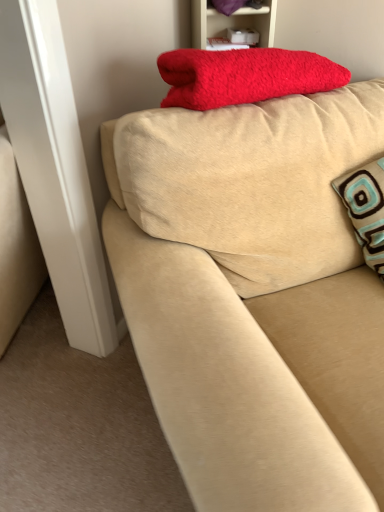
Question: Can you confirm if red fluffy blanket at upper center is shorter than beige fabric couch at upper center?

Choices:
 (A) yes
 (B) no

Answer: (A)

Question: Does red fluffy blanket at upper center appear on the right side of beige fabric couch at upper center?

Choices:
 (A) yes
 (B) no

Answer: (B)

Question: Is red fluffy blanket at upper center smaller than beige fabric couch at upper center?

Choices:
 (A) no
 (B) yes

Answer: (B)

Question: Considering the relative sizes of red fluffy blanket at upper center and beige fabric couch at upper center in the image provided, is red fluffy blanket at upper center taller than beige fabric couch at upper center?

Choices:
 (A) no
 (B) yes

Answer: (A)

Question: Is red fluffy blanket at upper center closer to the viewer compared to beige fabric couch at upper center?

Choices:
 (A) yes
 (B) no

Answer: (B)

Question: From the image's perspective, does red fluffy blanket at upper center appear lower than beige fabric couch at upper center?

Choices:
 (A) yes
 (B) no

Answer: (B)

Question: Is beige fabric couch at upper center positioned beyond the bounds of red fluffy blanket at upper center?

Choices:
 (A) yes
 (B) no

Answer: (A)

Question: Is beige fabric couch at upper center positioned with its back to red fluffy blanket at upper center?

Choices:
 (A) no
 (B) yes

Answer: (B)

Question: Is beige fabric couch at upper center in contact with red fluffy blanket at upper center?

Choices:
 (A) yes
 (B) no

Answer: (B)

Question: Is beige fabric couch at upper center positioned before red fluffy blanket at upper center?

Choices:
 (A) yes
 (B) no

Answer: (A)

Question: Is beige fabric couch at upper center taller than red fluffy blanket at upper center?

Choices:
 (A) no
 (B) yes

Answer: (B)

Question: Can you confirm if beige fabric couch at upper center is wider than red fluffy blanket at upper center?

Choices:
 (A) no
 (B) yes

Answer: (B)

Question: Considering the positions of beige fabric couch at upper center and red fluffy blanket at upper center in the image, is beige fabric couch at upper center bigger or smaller than red fluffy blanket at upper center?

Choices:
 (A) small
 (B) big

Answer: (B)